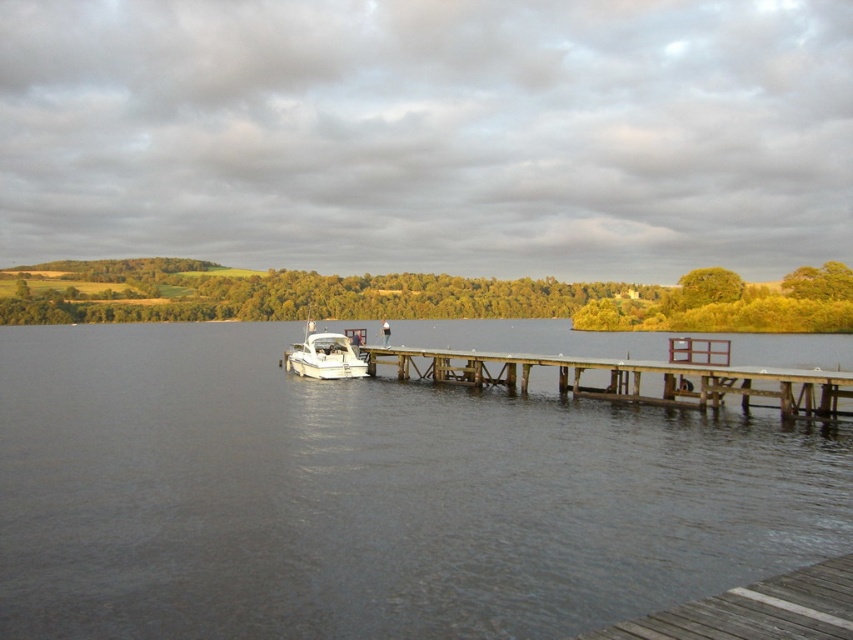
Question: From the image, what is the correct spatial relationship of wooden dock at center in relation to white glossy boat at center?

Choices:
 (A) above
 (B) below

Answer: (B)

Question: Can you confirm if wooden dock at center is bigger than white glossy boat at center?

Choices:
 (A) no
 (B) yes

Answer: (B)

Question: Which of the following is the farthest from the observer?

Choices:
 (A) clear water at dock center
 (B) wooden dock at center

Answer: (B)

Question: Does clear water at dock center come behind wooden dock at center?

Choices:
 (A) no
 (B) yes

Answer: (A)

Question: Which point is closer to the camera?

Choices:
 (A) white glossy boat at center
 (B) clear water at dock center
 (C) wooden dock at center

Answer: (B)

Question: Based on their relative distances, which object is nearer to the clear water at dock center?

Choices:
 (A) white glossy boat at center
 (B) wooden dock at center

Answer: (B)